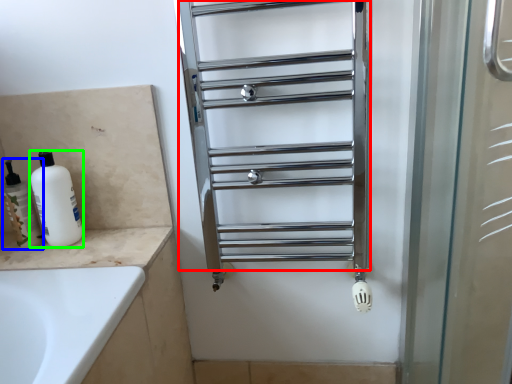
Question: Which object is positioned farthest from cage (highlighted by a red box)? Select from toiletry (highlighted by a blue box) and cleaning product (highlighted by a green box).

Choices:
 (A) toiletry
 (B) cleaning product

Answer: (A)